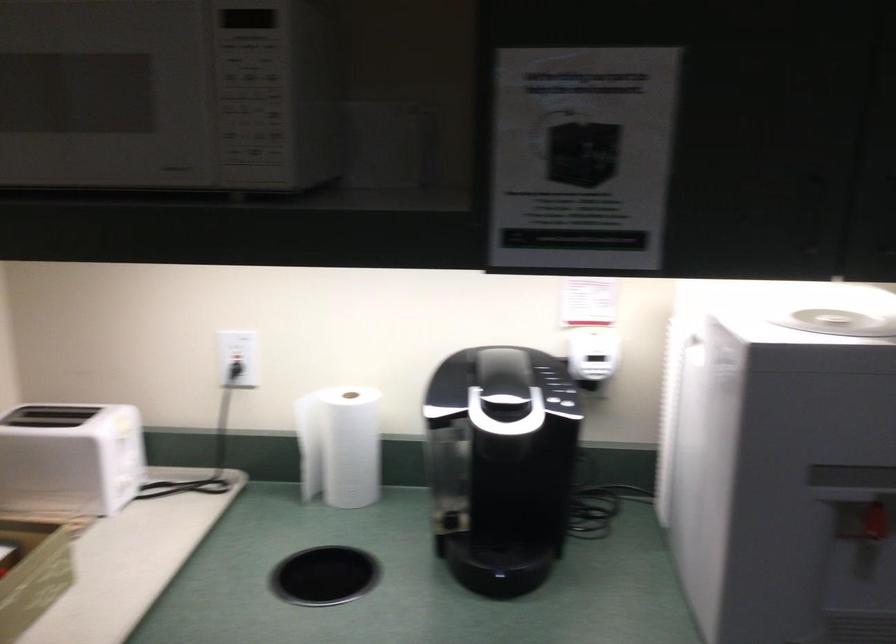
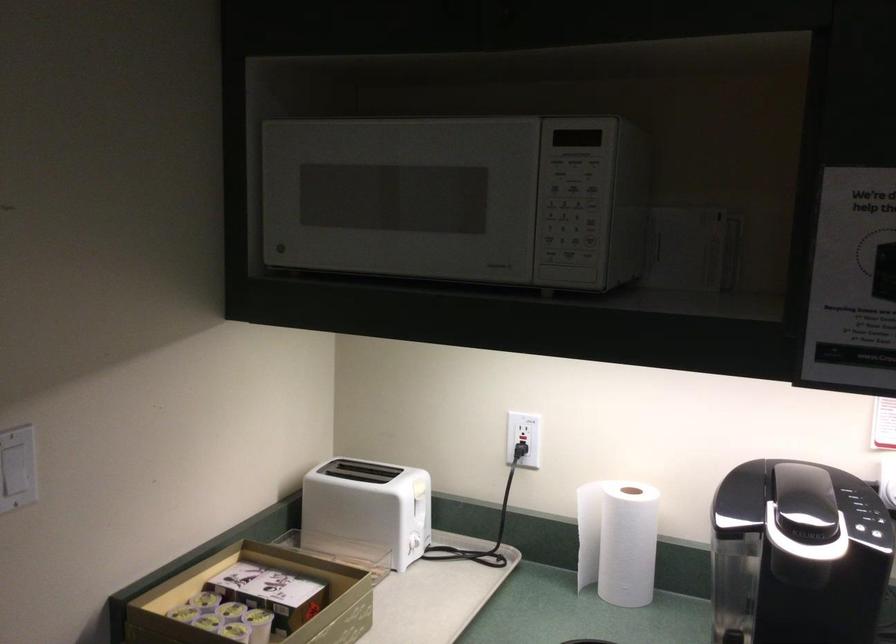
In the second image, find the point that corresponds to the point at 253,178 in the first image.

(565, 279)